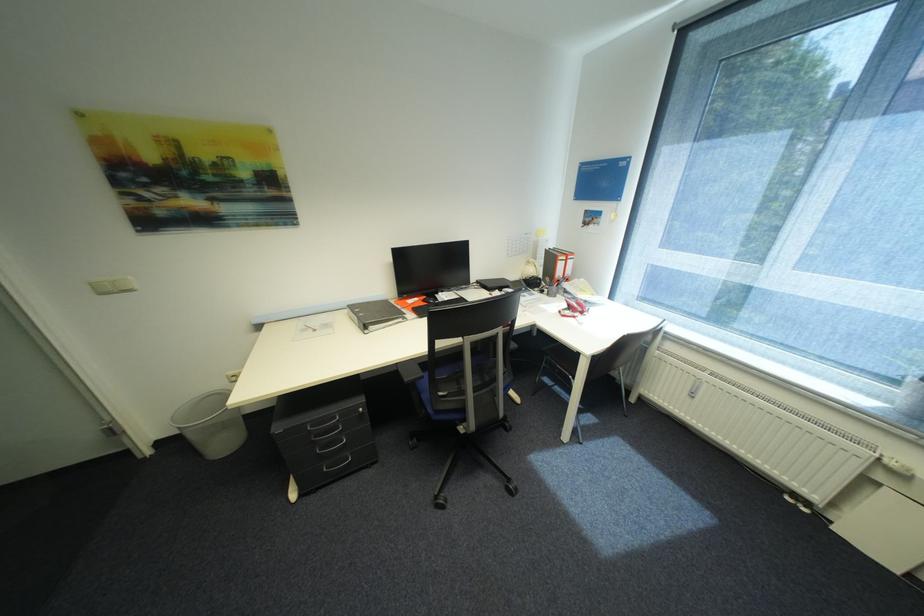
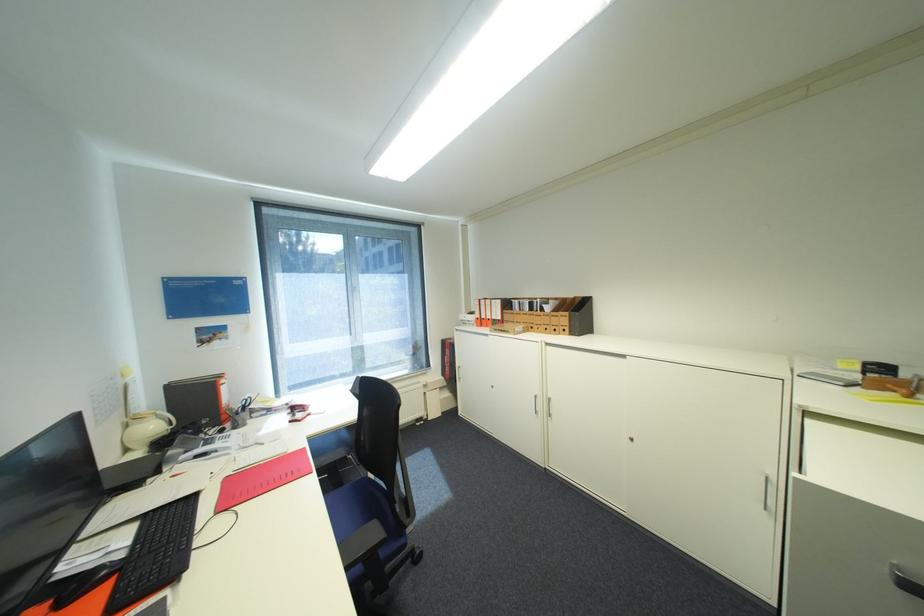
In the second image, find the point that corresponds to the point at 540,270 in the first image.

(161, 427)